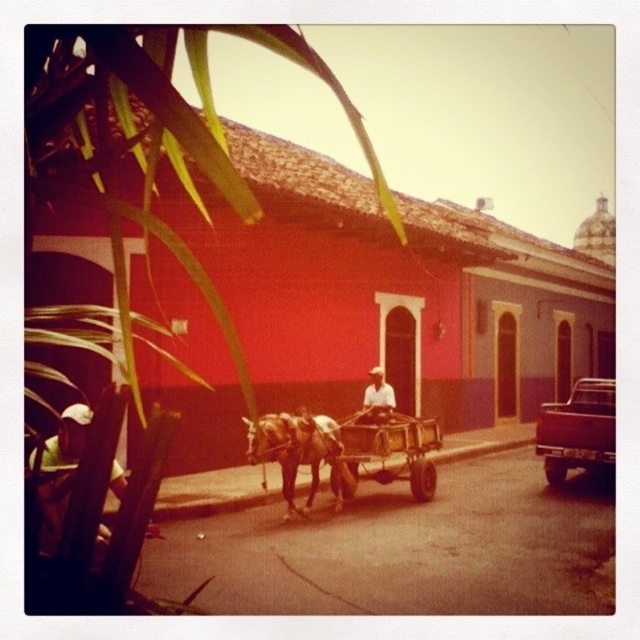
Question: Which point is closer to the camera taking this photo?

Choices:
 (A) (356, 419)
 (B) (612, 385)
 (C) (80, 420)

Answer: (C)

Question: Can you confirm if wooden cart at center is wider than metallic brown pickup truck at right?

Choices:
 (A) no
 (B) yes

Answer: (A)

Question: Which point is farther from the camera taking this photo?

Choices:
 (A) (61, 422)
 (B) (561, 460)

Answer: (B)

Question: Is wooden cart at center smaller than white clothed person at center?

Choices:
 (A) yes
 (B) no

Answer: (B)

Question: Which point appears farthest from the camera in this image?

Choices:
 (A) (321, 426)
 (B) (595, 397)

Answer: (B)

Question: Is wooden cart at center further to camera compared to green fabric hat at lower left?

Choices:
 (A) no
 (B) yes

Answer: (B)